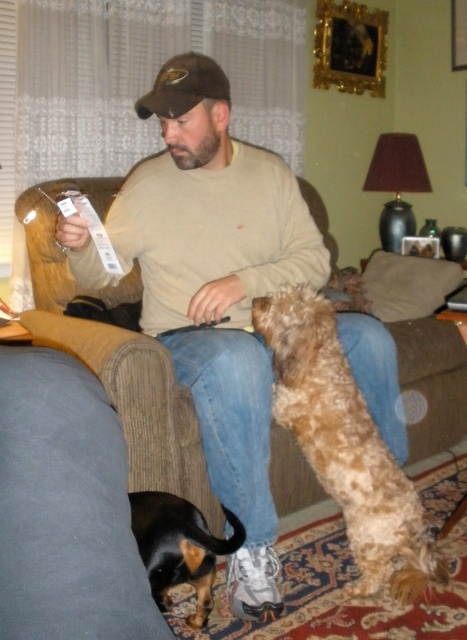
Is beige sweater at center wider than fuzzy brown dog at center?

Correct, the width of beige sweater at center exceeds that of fuzzy brown dog at center.

From the picture: Can you confirm if beige sweater at center is shorter than fuzzy brown dog at center?

No, beige sweater at center is not shorter than fuzzy brown dog at center.

Which is in front, point (285, 209) or point (312, 358)?

Point (312, 358) is in front.

I want to click on beige sweater at center, so [x=220, y=305].

Is point (212, 564) positioned before point (192, 77)?

Yes, it is in front of point (192, 77).

Can you confirm if black and tan fur at lower left is positioned to the right of brown fabric baseball cap at center?

Indeed, black and tan fur at lower left is positioned on the right side of brown fabric baseball cap at center.

Between point (161, 547) and point (175, 116), which one is positioned in front?

Positioned in front is point (161, 547).

In order to click on black and tan fur at lower left in this screenshot , I will do (179, 547).

Between point (238, 604) and point (198, 529), which one is positioned behind?

The point (238, 604) is behind.

Between beige sweater at center and black and tan fur at lower left, which one is positioned higher?

beige sweater at center is higher up.

Who is more distant from viewer, (193, 189) or (133, 506)?

The point (193, 189) is behind.

What are the coordinates of `beige sweater at center` in the screenshot? It's located at (220, 305).